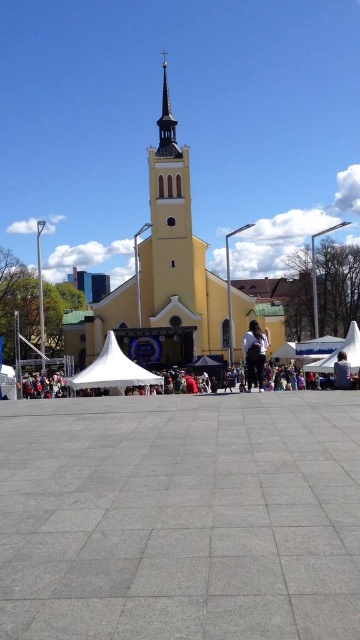
Which of these two, gold polished spire at center or white fabric canopy at lower right, stands taller?

Standing taller between the two is gold polished spire at center.

Is gold polished spire at center wider than white fabric canopy at lower right?

No.

The height and width of the screenshot is (640, 360). I want to click on gold polished spire at center, so click(167, 122).

Find the location of a particular element. white fabric canopy at lower right is located at coordinates (338, 352).

Is white fabric canopy at lower right thinner than matte black jacket at lower right?

No.

Is point (357, 349) closer to camera compared to point (348, 372)?

No, (357, 349) is further to viewer.

You are a GUI agent. You are given a task and a screenshot of the screen. Output one action in this format:
    pyautogui.click(x=<x>, y=<y>)
    Task: Click on the white fabric canopy at lower right
    
    Given the screenshot: What is the action you would take?
    pyautogui.click(x=338, y=352)

Does white cotton shirt at center lie behind white fabric canopy at lower right?

Yes, white cotton shirt at center is behind white fabric canopy at lower right.

This screenshot has height=640, width=360. Find the location of `white cotton shirt at center`. white cotton shirt at center is located at coordinates (254, 353).